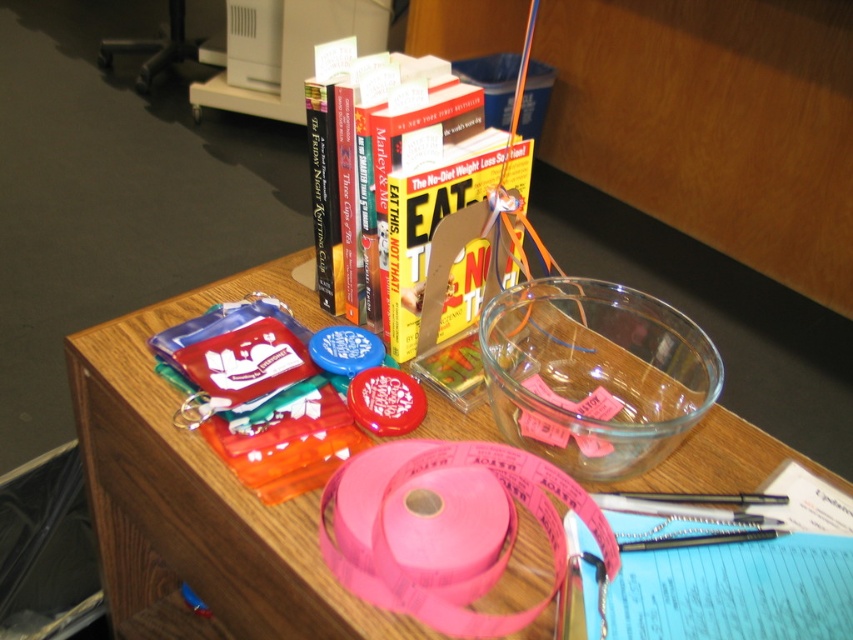
Between pink plastic tape at center and transparent glass bowl at center, which one has more height?

With more height is pink plastic tape at center.

Is point (326, 576) positioned in front of point (672, 401)?

Yes, it is.

The width and height of the screenshot is (853, 640). I want to click on pink plastic tape at center, so click(198, 497).

Is point (572, 296) positioned behind point (409, 550)?

Yes.

Which is behind, point (529, 397) or point (457, 474)?

Point (529, 397)

Find the location of a particular element. transparent glass bowl at center is located at coordinates (595, 372).

Does pink paper ribbon at center have a lesser height compared to pink matte tape at center?

Incorrect, pink paper ribbon at center's height does not fall short of pink matte tape at center's.

The height and width of the screenshot is (640, 853). What do you see at coordinates (445, 529) in the screenshot?
I see `pink paper ribbon at center` at bounding box center [445, 529].

Where is `pink paper ribbon at center`? pink paper ribbon at center is located at coordinates (445, 529).